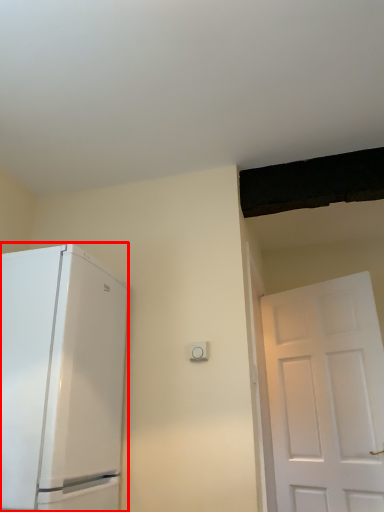
Question: Considering the relative positions of refrigerator (annotated by the red box) and light switch in the image provided, where is refrigerator (annotated by the red box) located with respect to the staircase?

Choices:
 (A) right
 (B) left

Answer: (B)